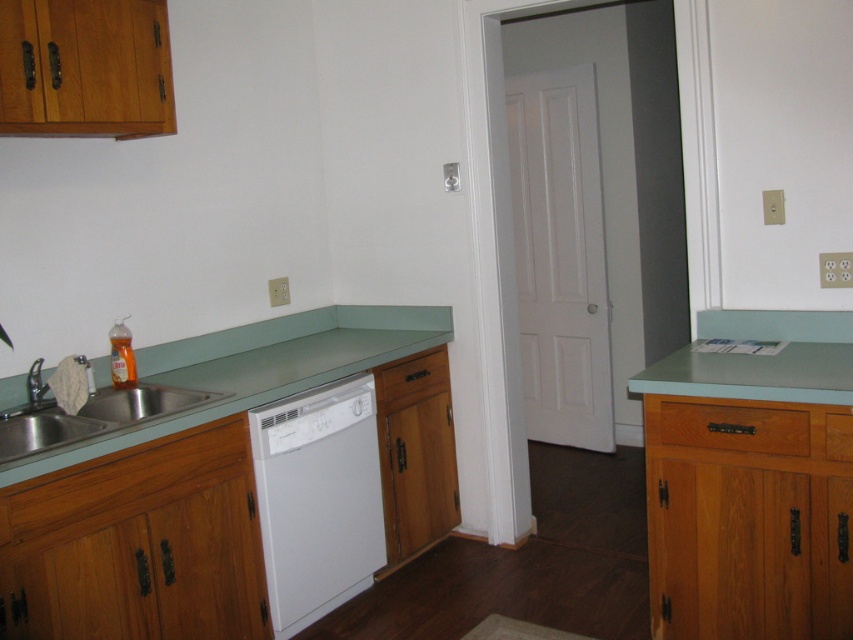
Is white matte dishwasher at center smaller than green matte countertop at lower left?

Correct, white matte dishwasher at center occupies less space than green matte countertop at lower left.

Which is above, white matte dishwasher at center or green matte countertop at lower left?

green matte countertop at lower left is higher up.

This screenshot has width=853, height=640. I want to click on white matte dishwasher at center, so click(x=317, y=499).

At what (x,y) coordinates should I click in order to perform the action: click on white matte dishwasher at center. Please return your answer as a coordinate pair (x, y). Looking at the image, I should click on (317, 499).

Does stainless steel sink at lower left have a larger size compared to brushed metal faucet at sink left?

Indeed, stainless steel sink at lower left has a larger size compared to brushed metal faucet at sink left.

Does stainless steel sink at lower left appear on the right side of brushed metal faucet at sink left?

Correct, you'll find stainless steel sink at lower left to the right of brushed metal faucet at sink left.

You are a GUI agent. You are given a task and a screenshot of the screen. Output one action in this format:
    pyautogui.click(x=<x>, y=<y>)
    Task: Click on the stainless steel sink at lower left
    
    Given the screenshot: What is the action you would take?
    pyautogui.click(x=91, y=417)

Which of these two, green matte countertop at lower left or stainless steel sink at lower left, stands shorter?

stainless steel sink at lower left

Between green matte countertop at lower left and stainless steel sink at lower left, which one has more height?

Standing taller between the two is green matte countertop at lower left.

Who is more forward, (283,381) or (9,461)?

Positioned in front is point (9,461).

Where is `green matte countertop at lower left`? The image size is (853, 640). green matte countertop at lower left is located at coordinates (257, 369).